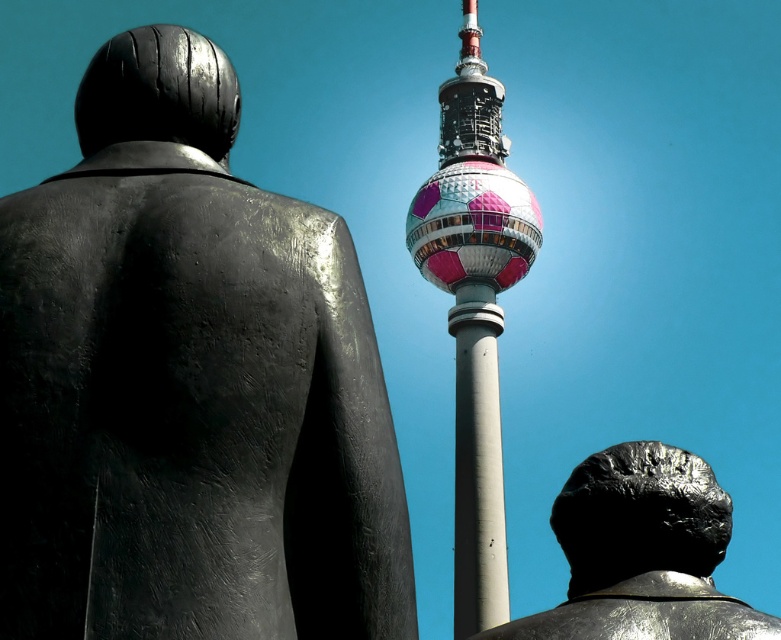
Question: Among these objects, which one is farthest from the camera?

Choices:
 (A) matte black statue at left
 (B) shiny metallic tower at center

Answer: (B)

Question: Among these points, which one is nearest to the camera?

Choices:
 (A) (428, 211)
 (B) (37, 580)

Answer: (B)

Question: Which of the following is the farthest from the observer?

Choices:
 (A) shiny metallic tower at center
 (B) polished bronze head at right

Answer: (A)

Question: Does matte black statue at left have a lesser width compared to polished bronze head at right?

Choices:
 (A) yes
 (B) no

Answer: (A)

Question: Is matte black statue at left to the left of shiny metallic tower at center from the viewer's perspective?

Choices:
 (A) no
 (B) yes

Answer: (B)

Question: Is shiny metallic tower at center to the left of polished bronze head at right from the viewer's perspective?

Choices:
 (A) yes
 (B) no

Answer: (A)